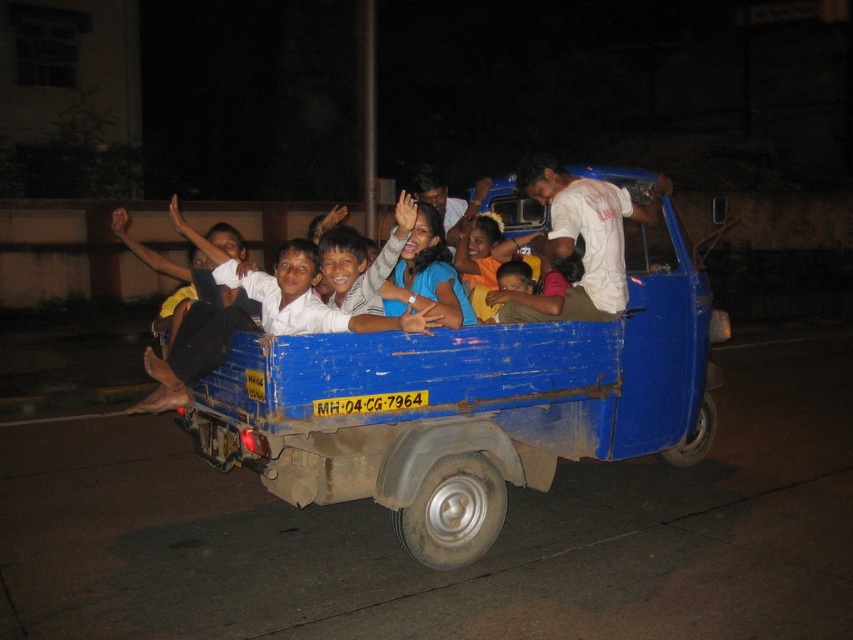
Question: Where is blue matte truck at center located in relation to white cotton shirt at upper center in the image?

Choices:
 (A) right
 (B) left

Answer: (B)

Question: Does blue matte truck at center have a lesser width compared to white cotton shirt at upper center?

Choices:
 (A) yes
 (B) no

Answer: (B)

Question: Is blue matte truck at center thinner than white cotton shirt at upper center?

Choices:
 (A) no
 (B) yes

Answer: (A)

Question: Which point is farther to the camera?

Choices:
 (A) white cotton shirt at upper center
 (B) blue matte truck at center

Answer: (A)

Question: Which object is farther from the camera taking this photo?

Choices:
 (A) blue matte truck at center
 (B) white cotton shirt at upper center

Answer: (B)